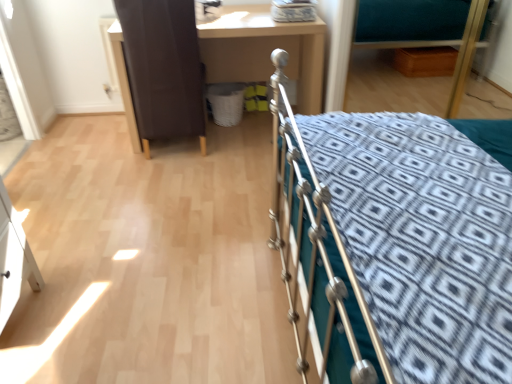
Question: From the image's perspective, is teal fabric hospital bed at upper right located above or below brown leather screen door at upper left?

Choices:
 (A) below
 (B) above

Answer: (B)

Question: Does point (458, 96) appear closer or farther from the camera than point (130, 46)?

Choices:
 (A) closer
 (B) farther

Answer: (B)

Question: Estimate the real-world distances between objects in this image. Which object is farther from the teal fabric hospital bed at upper right?

Choices:
 (A) brown leather screen door at upper left
 (B) matte brown desk at center
 (C) silver metallic bed at right

Answer: (C)

Question: Estimate the real-world distances between objects in this image. Which object is farther from the matte brown desk at center?

Choices:
 (A) teal fabric hospital bed at upper right
 (B) brown leather screen door at upper left
 (C) silver metallic bed at right

Answer: (C)